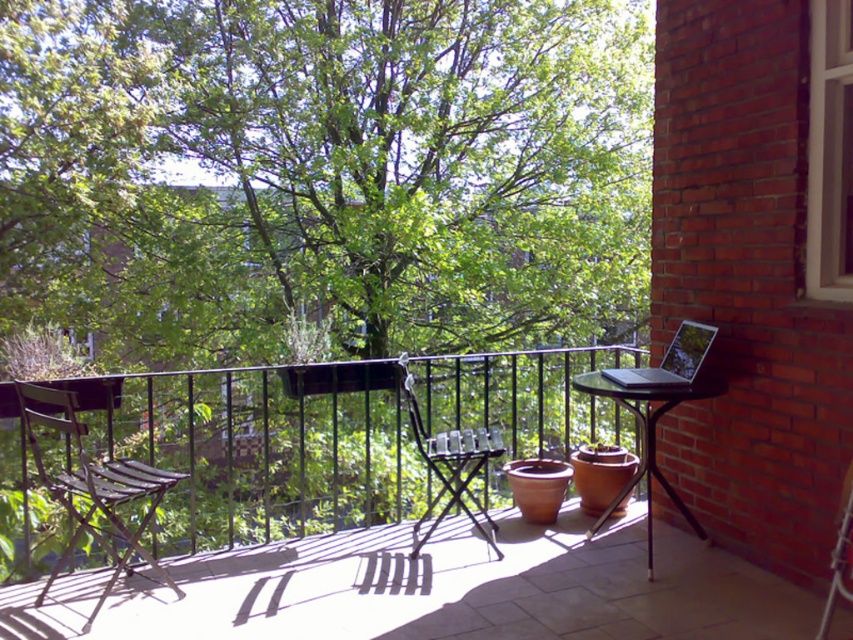
Question: Based on their relative distances, which object is farther from the wooden slatted chair at left?

Choices:
 (A) silver metallic laptop at right
 (B) black metal table at right
 (C) metallic silver chair at lower right

Answer: (C)

Question: Can you confirm if wooden slatted chair at left is bigger than black metal chair at center?

Choices:
 (A) yes
 (B) no

Answer: (A)

Question: Is wooden slatted chair at left thinner than black metal table at right?

Choices:
 (A) no
 (B) yes

Answer: (A)

Question: Which object is farther from the camera taking this photo?

Choices:
 (A) metallic silver chair at lower right
 (B) black metal chair at center
 (C) wooden slatted chair at left

Answer: (B)

Question: Is black metal chair at center smaller than metallic silver chair at lower right?

Choices:
 (A) yes
 (B) no

Answer: (B)

Question: Which point appears farthest from the camera in this image?

Choices:
 (A) (680, 365)
 (B) (846, 547)

Answer: (A)